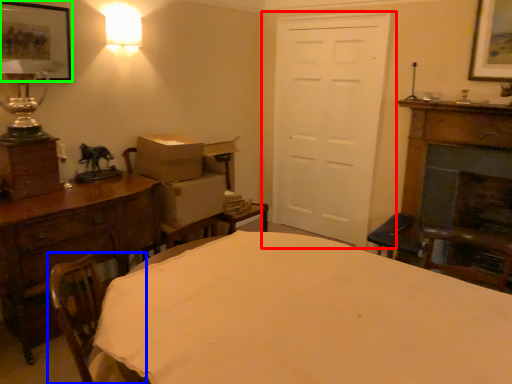
Question: Which object is the closest to the door (highlighted by a red box)? Choose among these: swivel chair (highlighted by a blue box) or picture frame (highlighted by a green box).

Choices:
 (A) swivel chair
 (B) picture frame

Answer: (B)